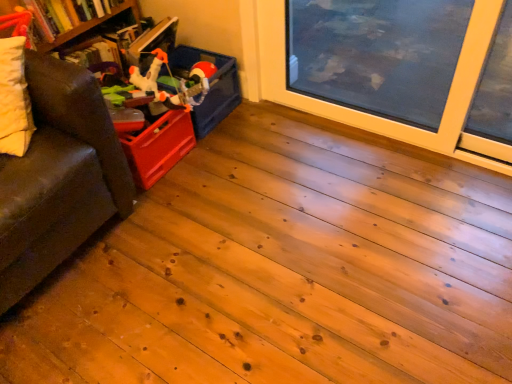
Question: Is wooden bookshelf at left to the left or to the right of hardcover book at upper left in the image?

Choices:
 (A) left
 (B) right

Answer: (A)

Question: Is wooden bookshelf at left inside the boundaries of hardcover book at upper left, or outside?

Choices:
 (A) inside
 (B) outside

Answer: (B)

Question: Based on their relative distances, which object is farther from the hardcover book at upper left?

Choices:
 (A) matte plastic storage box at upper left
 (B) matte plastic toy at upper left
 (C) brown leather couch at left
 (D) wooden bookshelf at left

Answer: (C)

Question: Which of these objects is positioned farthest from the brown leather couch at left?

Choices:
 (A) hardcover book at upper left
 (B) matte plastic storage box at upper left
 (C) matte plastic toy at upper left
 (D) wooden bookshelf at left

Answer: (D)